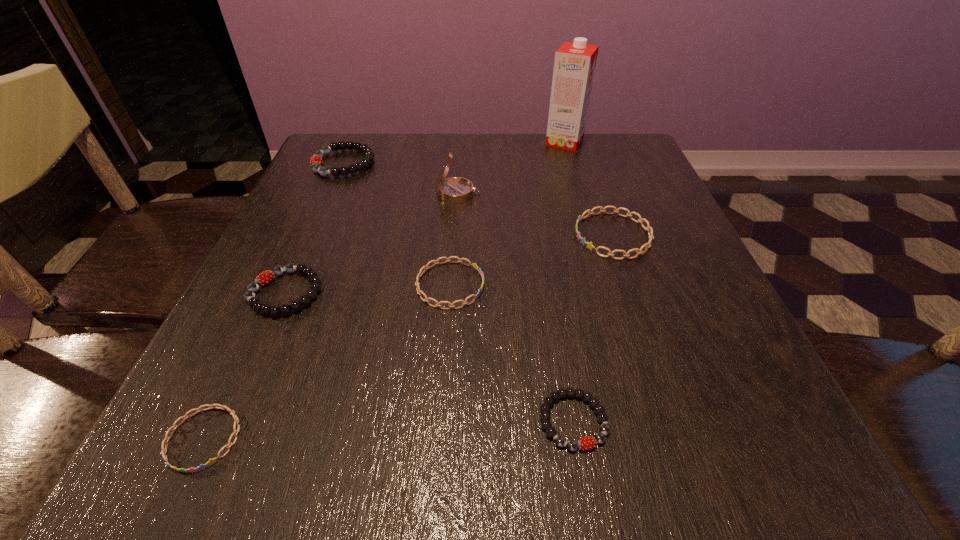
Image resolution: width=960 pixels, height=540 pixels. I want to click on the fifth bracelet from left to right, so click(599, 438).

Find the location of `the nearest black bracelet`. the nearest black bracelet is located at coordinates (599, 438).

The height and width of the screenshot is (540, 960). In order to click on the leftmost blue bracelet in this screenshot , I will do point(166,439).

Where is `the nearest blue bracelet`? The height and width of the screenshot is (540, 960). the nearest blue bracelet is located at coordinates (166, 439).

This screenshot has height=540, width=960. What are the coordinates of `vacant position located on the left of the tallest object` in the screenshot? It's located at (487, 141).

What are the coordinates of `free space located 0.100m with the dial facing the seventh shortest object` in the screenshot? It's located at (525, 194).

The height and width of the screenshot is (540, 960). I want to click on vacant area situated 0.290m on the right of the farthest black bracelet, so click(494, 163).

Where is `vacant space located 0.090m on the surface of the rightmost blue bracelet showing star-shaped elements`? vacant space located 0.090m on the surface of the rightmost blue bracelet showing star-shaped elements is located at coordinates (529, 235).

In order to click on blank space located 0.130m on the surface of the rightmost blue bracelet showing star-shaped elements in this screenshot , I will do `click(509, 235)`.

You are a GUI agent. You are given a task and a screenshot of the screen. Output one action in this format:
    pyautogui.click(x=<x>, y=<y>)
    Task: Click on the blank space located on the surface of the rightmost blue bracelet showing star-shaped elements
    This screenshot has width=960, height=540.
    Given the screenshot: What is the action you would take?
    pyautogui.click(x=417, y=235)